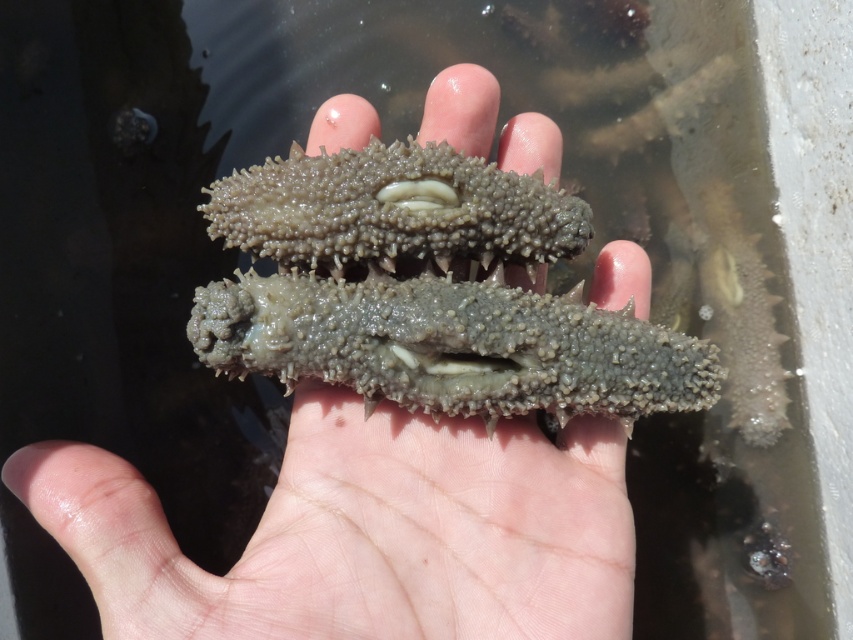
Question: Which point is farther from the camera taking this photo?

Choices:
 (A) (397, 285)
 (B) (3, 474)

Answer: (A)

Question: Which of the following is the closest to the observer?

Choices:
 (A) gray matte sea cucumber at center
 (B) gray rough sea cucumber at center

Answer: (A)

Question: In this image, where is gray matte sea cucumber at center located relative to gray rough sea cucumber at center?

Choices:
 (A) above
 (B) below

Answer: (B)

Question: Is gray matte sea cucumber at center in front of gray rough sea cucumber at center?

Choices:
 (A) no
 (B) yes

Answer: (B)

Question: Is gray matte sea cucumber at center positioned behind gray rough sea cucumber at center?

Choices:
 (A) yes
 (B) no

Answer: (B)